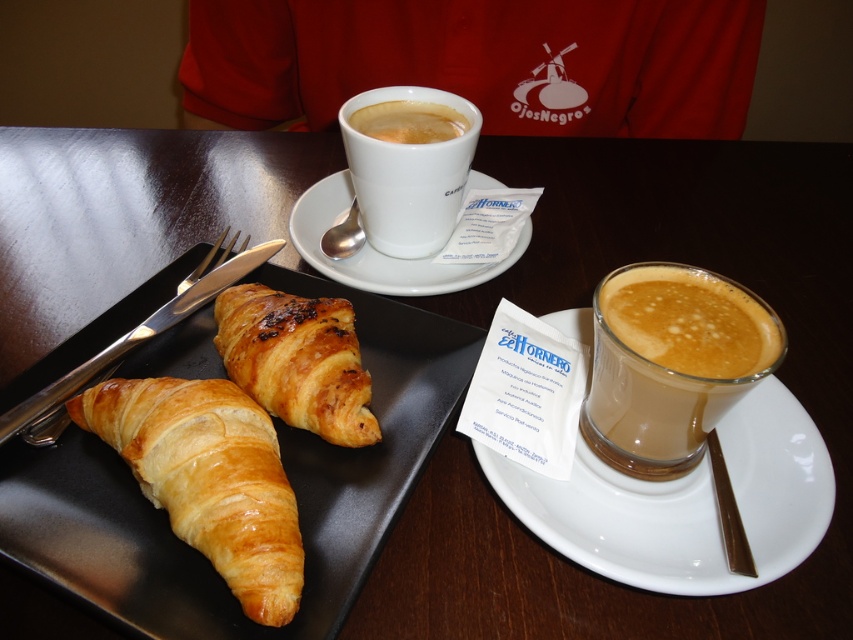
Which is behind, point (149, 465) or point (479, 188)?

The point (479, 188) is more distant.

Between golden brown flaky croissant at lower left and white ceramic saucer at upper center, which one is positioned higher?

white ceramic saucer at upper center is above.

What do you see at coordinates (207, 477) in the screenshot? I see `golden brown flaky croissant at lower left` at bounding box center [207, 477].

The width and height of the screenshot is (853, 640). What are the coordinates of `golden brown flaky croissant at lower left` in the screenshot? It's located at (207, 477).

Between translucent glass cup at center and white ceramic cup at center, which one is positioned higher?

white ceramic cup at center

Is translucent glass cup at center bigger than white ceramic cup at center?

No.

Which is in front, point (651, 464) or point (352, 104)?

Positioned in front is point (651, 464).

You are a GUI agent. You are given a task and a screenshot of the screen. Output one action in this format:
    pyautogui.click(x=<x>, y=<y>)
    Task: Click on the translucent glass cup at center
    
    Given the screenshot: What is the action you would take?
    pyautogui.click(x=672, y=369)

Does golden brown flaky croissant at lower left have a larger size compared to translucent glass cup at center?

Yes, golden brown flaky croissant at lower left is bigger than translucent glass cup at center.

Measure the distance between point (194, 486) and camera.

Point (194, 486) is 10.35 inches from camera.

Describe the element at coordinates (207, 477) in the screenshot. I see `golden brown flaky croissant at lower left` at that location.

You are a GUI agent. You are given a task and a screenshot of the screen. Output one action in this format:
    pyautogui.click(x=<x>, y=<y>)
    Task: Click on the golden brown flaky croissant at lower left
    The width and height of the screenshot is (853, 640).
    Given the screenshot: What is the action you would take?
    pyautogui.click(x=207, y=477)